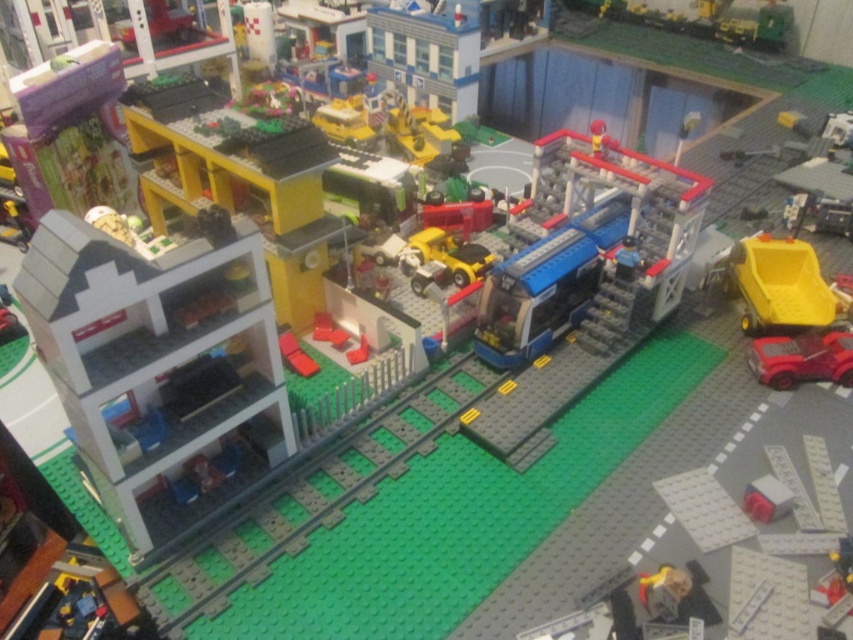
I want to click on blue plastic bus at center, so click(x=585, y=243).

Which is more to the left, blue plastic bus at center or shiny red car at lower right?

blue plastic bus at center is more to the left.

You are a GUI agent. You are given a task and a screenshot of the screen. Output one action in this format:
    pyautogui.click(x=<x>, y=<y>)
    Task: Click on the blue plastic bus at center
    Image resolution: width=853 pixels, height=640 pixels.
    Given the screenshot: What is the action you would take?
    pyautogui.click(x=585, y=243)

You are a GUI agent. You are given a task and a screenshot of the screen. Output one action in this format:
    pyautogui.click(x=<x>, y=<y>)
    Task: Click on the blue plastic bus at center
    This screenshot has width=853, height=640.
    Given the screenshot: What is the action you would take?
    pyautogui.click(x=585, y=243)